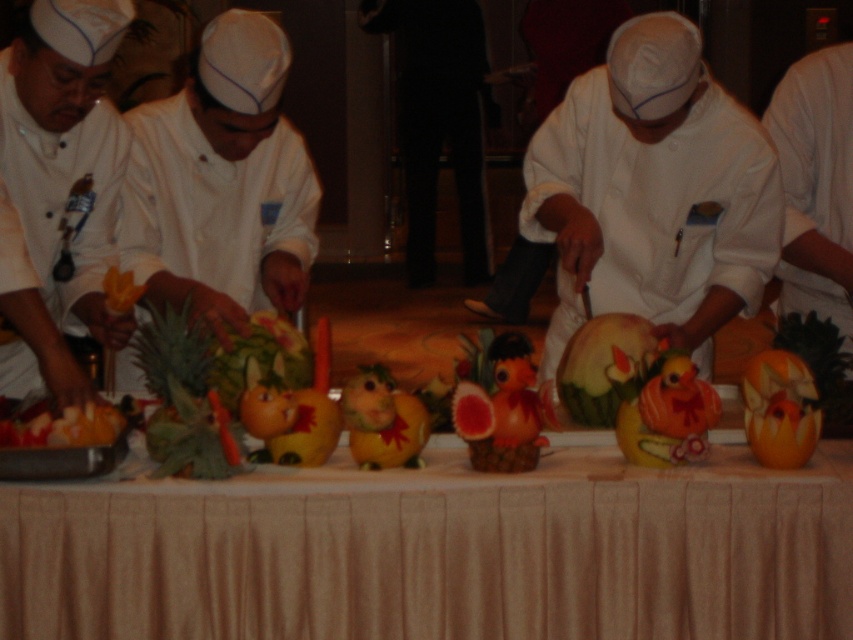
Question: Does white matte chef coat at center appear over white matte chef hat at center?

Choices:
 (A) no
 (B) yes

Answer: (A)

Question: Is matte white chef at left in front of smooth orange pumpkin at center?

Choices:
 (A) no
 (B) yes

Answer: (A)

Question: Is white matte chef hat at center positioned in front of smooth orange pumpkin at center?

Choices:
 (A) yes
 (B) no

Answer: (B)

Question: Which of the following is the closest to the observer?

Choices:
 (A) matte white chef at left
 (B) white matte chef coat at center
 (C) smooth orange pumpkin at center
 (D) white cloth table at center

Answer: (D)

Question: Which point is farther to the camera?

Choices:
 (A) (73, 404)
 (B) (347, 632)
 (C) (48, 138)
 (D) (165, 152)

Answer: (D)

Question: Which of these objects is positioned farthest from the smooth orange pumpkin at center?

Choices:
 (A) white matte chef hat at center
 (B) matte white chef at left
 (C) white cloth table at center

Answer: (B)